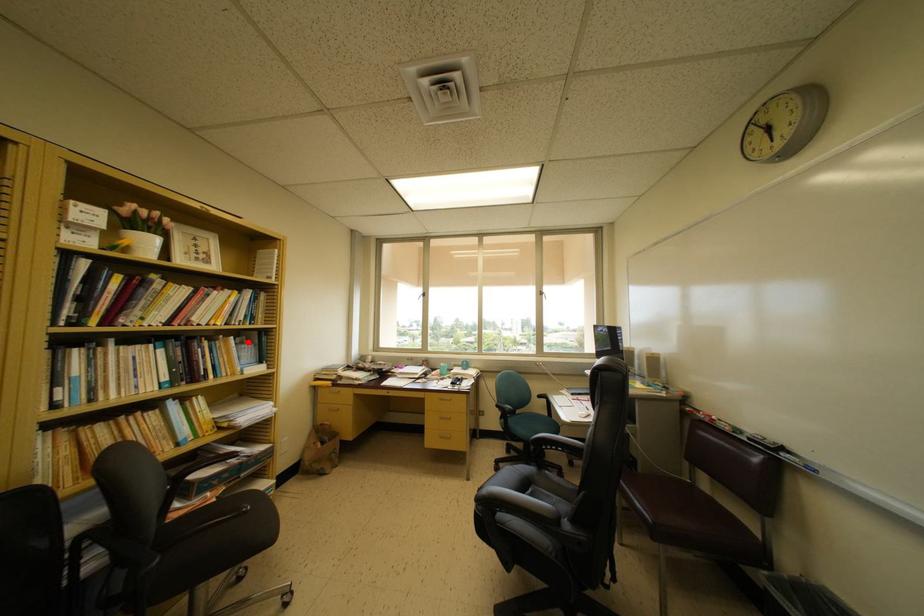
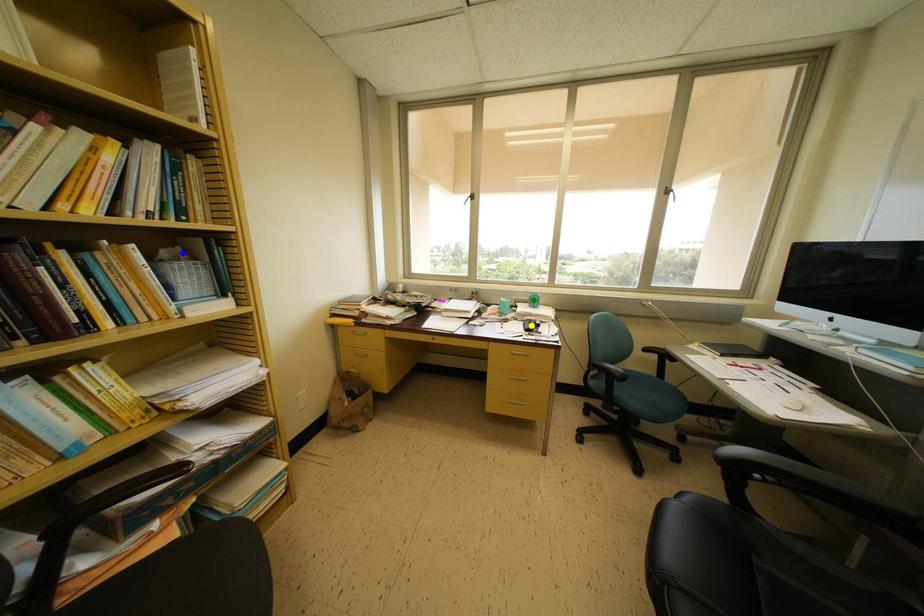
Question: I am providing you with two images of the same scene from different viewpoints. A red point is marked on the first image. You are given multiple points on the second image. Which spot in image 2 lines up with the point in image 1?

Choices:
 (A) blue point
 (B) yellow point
 (C) green point

Answer: (A)